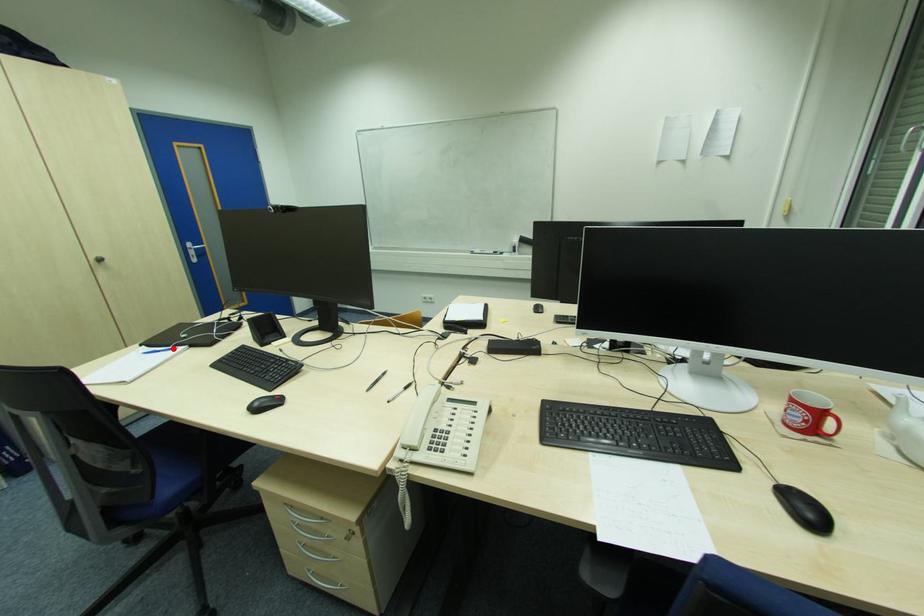
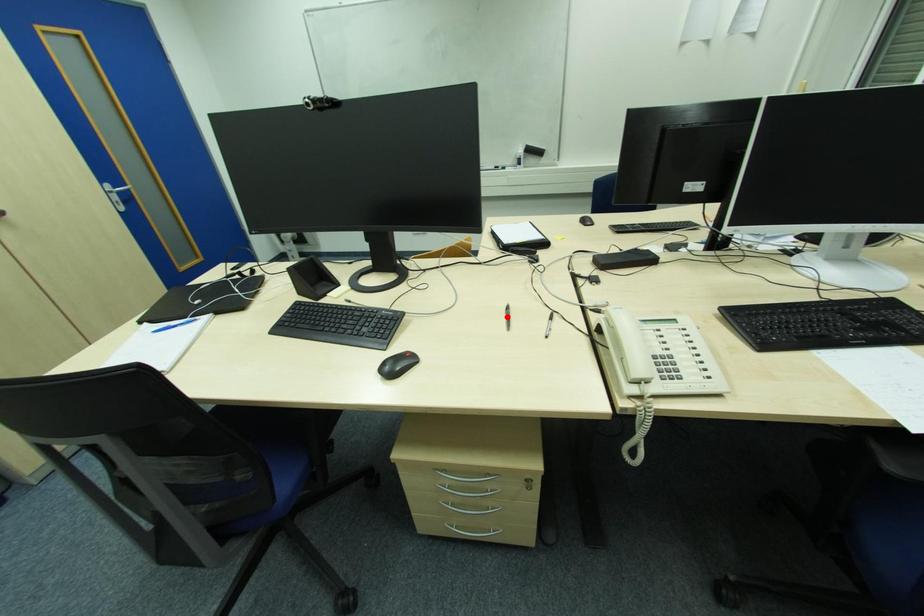
I am providing you with two images of the same scene from different viewpoints. A red point is marked on the first image and another point is marked on the second image. Does the point marked in image1 correspond to the same location as the one in image2?

No